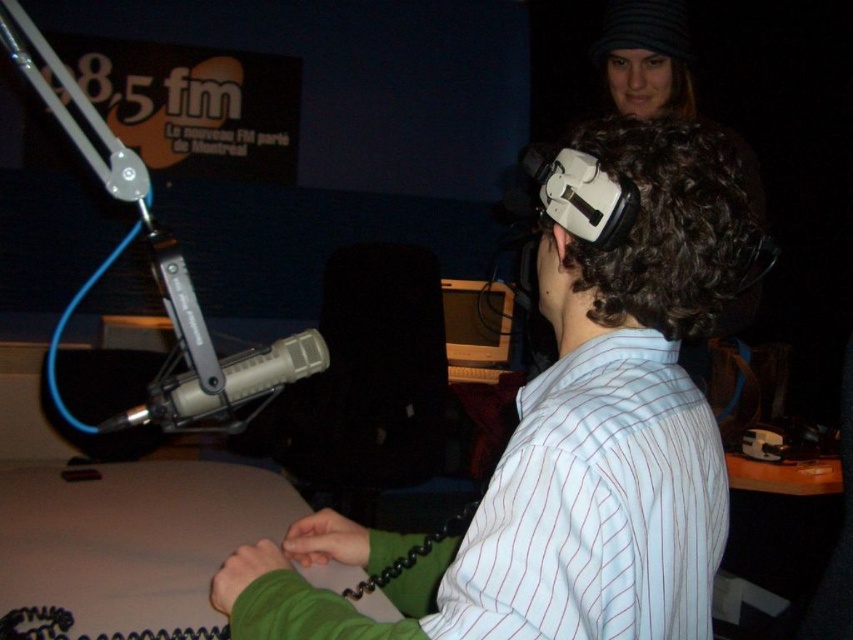
You are standing in the radio station studio and want to place a small plant between the two points marked as point (437, 618) and point (300, 349). Which point should the plant be closer to in order to be nearer to the viewer?

The plant should be placed closer to point (437, 618) because it is closer to the viewer than point (300, 349).

You are a technician in a radio station studio. You need to place a new microphone stand exactly where the white matte vr headset at center is currently located. The current microphone stand is at the left of the frame. Can you confirm if the new microphone stand will be placed in the center of the studio?

The white matte vr headset at center is located at point (x=569, y=442), so placing the new microphone stand there would position it at the center of the studio.

You are a guest speaker in the radio station studio. You need to start your speech by addressing the audience through the microphone. Which object should you approach first, the matte gray microphone at left or the wooden desktop computer at center?

You should approach the matte gray microphone at left first because it is in front of the wooden desktop computer at center, making it closer to you.